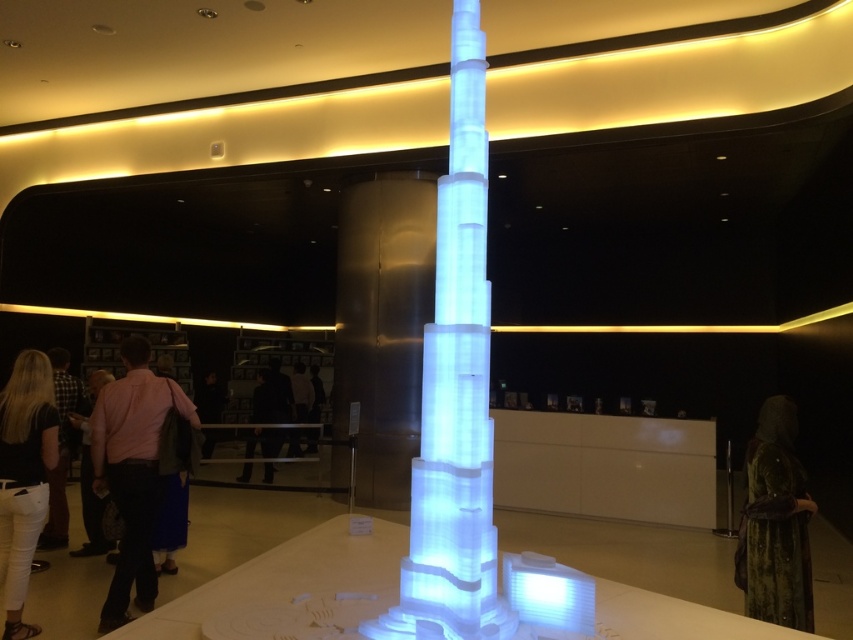
Question: Is pink fabric shirt at center thinner than velvet green dress at lower right?

Choices:
 (A) yes
 (B) no

Answer: (B)

Question: Which point is farther to the camera?

Choices:
 (A) velvet green dress at lower right
 (B) pink fabric shirt at center
 (C) dark matte suit at center
 (D) black denim jeans at lower left

Answer: (C)

Question: Which object appears farthest from the camera in this image?

Choices:
 (A) black denim jeans at lower left
 (B) pink fabric shirt at center

Answer: (B)

Question: Which is farther from the velvet green dress at lower right?

Choices:
 (A) pink shirt at left
 (B) dark matte suit at center
 (C) icy white plastic tower at center

Answer: (B)

Question: From the image, what is the correct spatial relationship of pink fabric shirt at center in relation to dark matte suit at center?

Choices:
 (A) above
 (B) below

Answer: (A)

Question: Is pink fabric shirt at center smaller than velvet green dress at lower right?

Choices:
 (A) yes
 (B) no

Answer: (B)